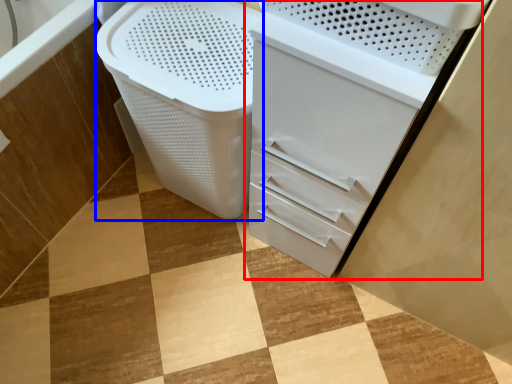
Question: Among these objects, which one is farthest to the camera, file cabinet (highlighted by a red box) or laundry basket (highlighted by a blue box)?

Choices:
 (A) file cabinet
 (B) laundry basket

Answer: (B)